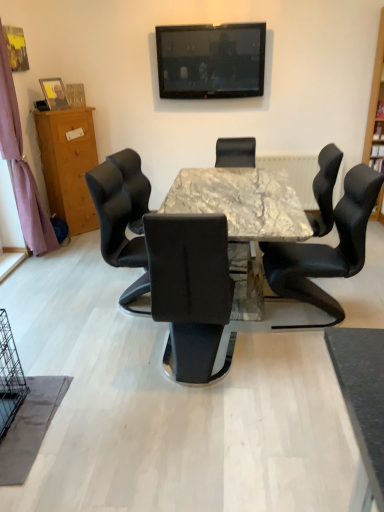
The width and height of the screenshot is (384, 512). I want to click on free space above black glossy television at upper center (from a real-world perspective), so click(211, 23).